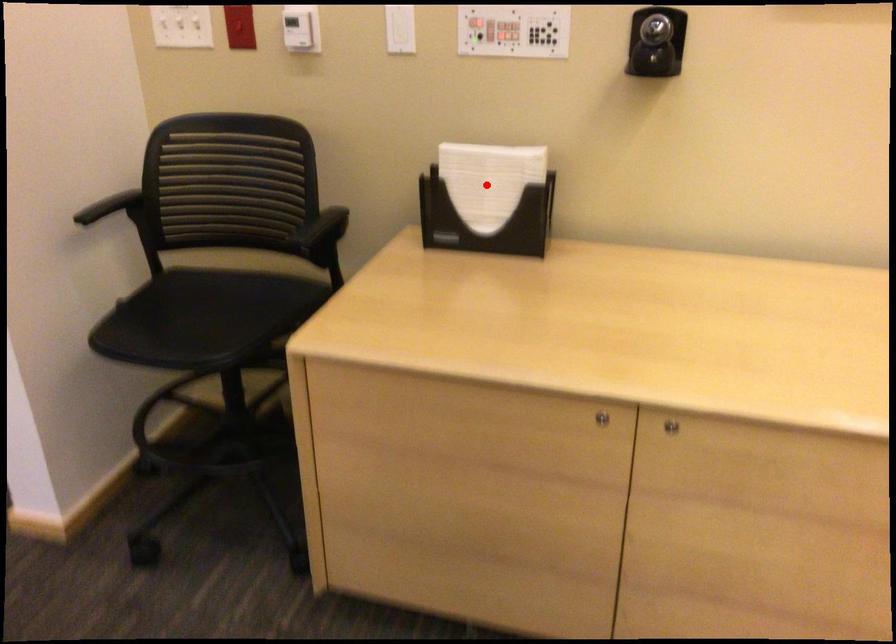
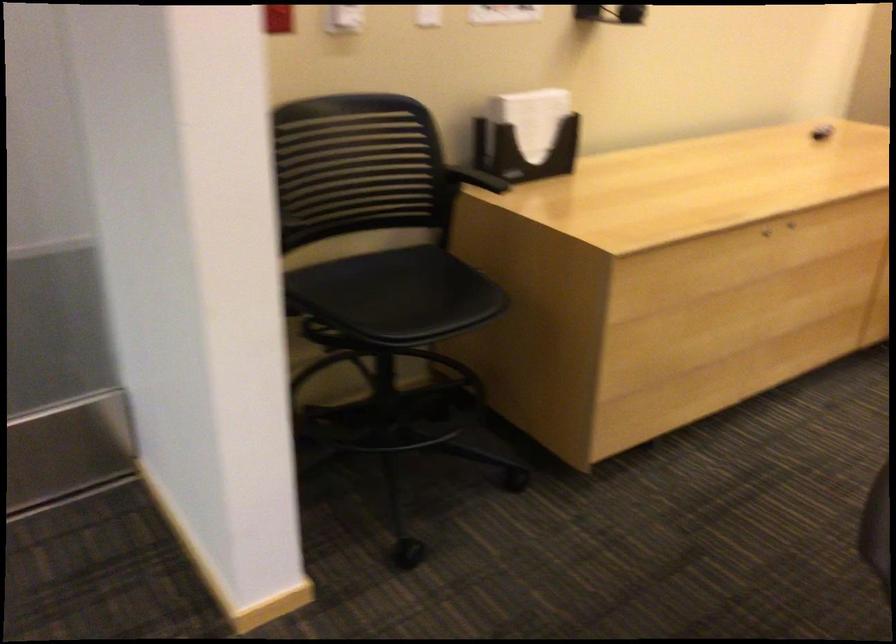
In the second image, find the point that corresponds to the highlighted location in the first image.

(531, 118)